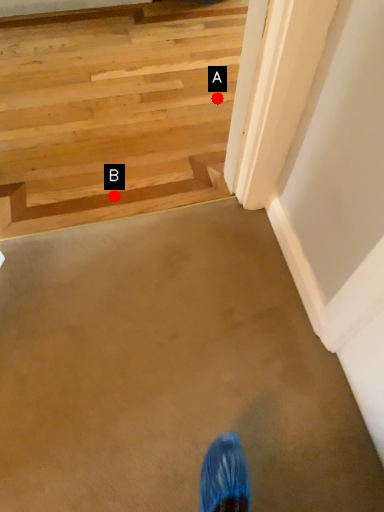
Question: Two points are circled on the image, labeled by A and B beside each circle. Which point is further to the camera?

Choices:
 (A) A is further
 (B) B is further

Answer: (A)